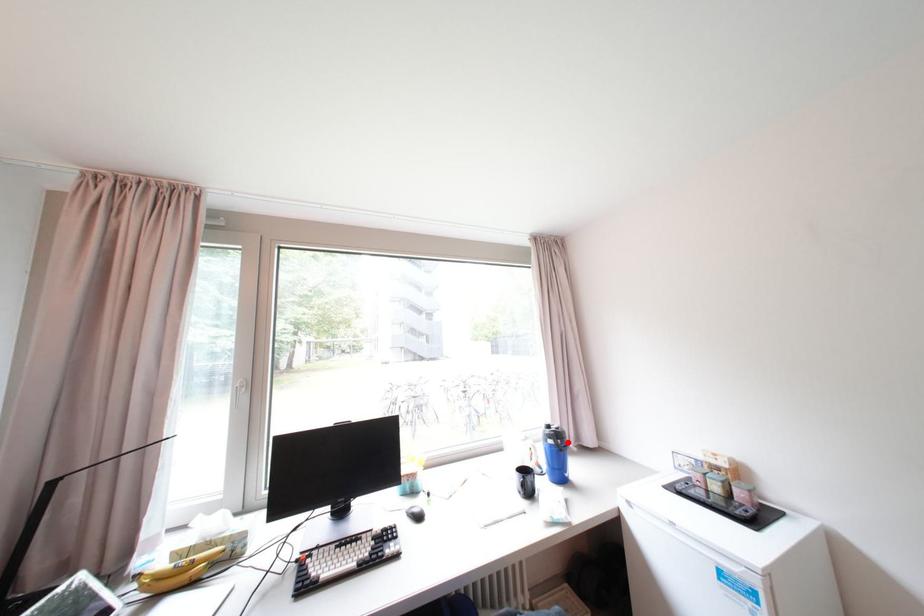
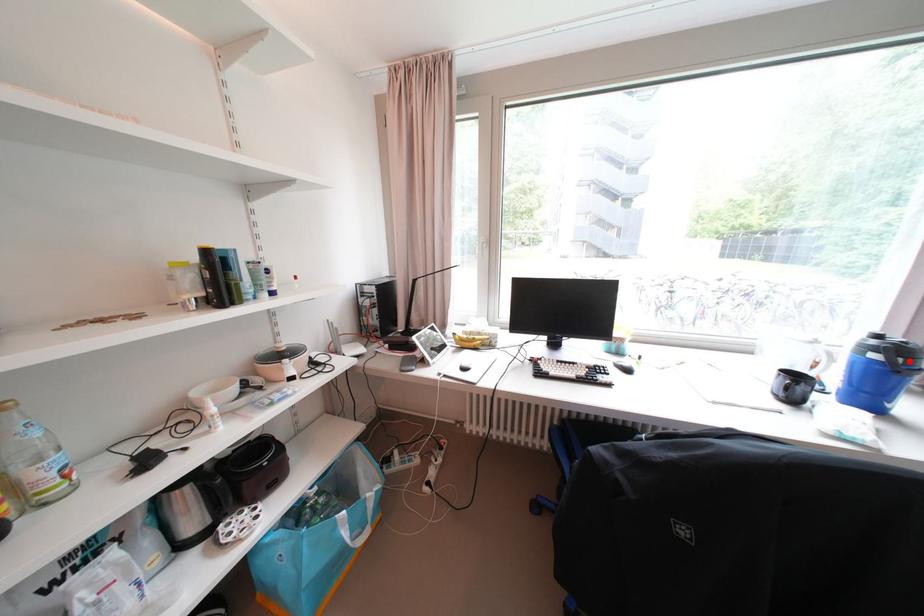
I am providing you with two images of the same scene from different viewpoints. A red point is marked on the first image and another point is marked on the second image. Are the points marked in image1 and image2 representing the same 3D position?

Yes